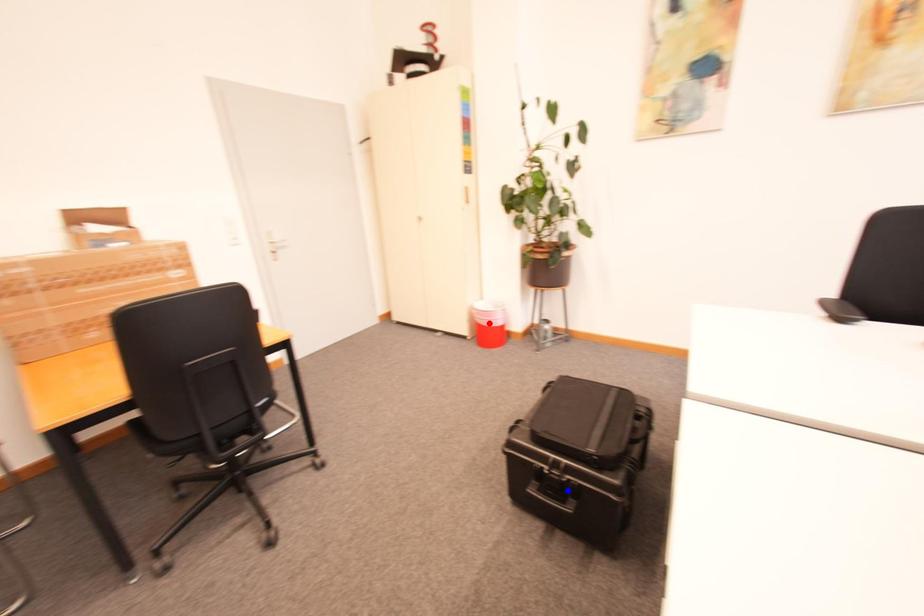
Question: In the image, two points are highlighted. Which point is nearer to the camera? Reply with the corresponding letter.

Choices:
 (A) blue point
 (B) red point

Answer: (A)